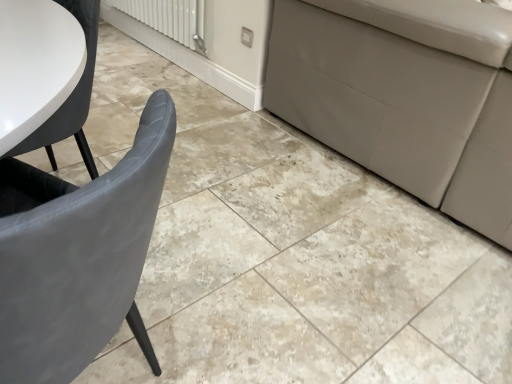
Question: From the image's perspective, is matte gray chair at left over white glossy radiator at upper center?

Choices:
 (A) no
 (B) yes

Answer: (A)

Question: Considering the relative sizes of matte gray chair at left and white glossy radiator at upper center in the image provided, is matte gray chair at left wider than white glossy radiator at upper center?

Choices:
 (A) no
 (B) yes

Answer: (B)

Question: From a real-world perspective, does matte gray chair at left sit lower than white glossy radiator at upper center?

Choices:
 (A) yes
 (B) no

Answer: (B)

Question: Does matte gray chair at left lie in front of white glossy radiator at upper center?

Choices:
 (A) yes
 (B) no

Answer: (A)

Question: Is the position of matte gray chair at left more distant than that of white glossy radiator at upper center?

Choices:
 (A) no
 (B) yes

Answer: (A)

Question: From a real-world perspective, is matte gray chair at left over white glossy radiator at upper center?

Choices:
 (A) no
 (B) yes

Answer: (B)

Question: Is white glossy radiator at upper center not near matte gray chair at left?

Choices:
 (A) yes
 (B) no

Answer: (A)

Question: Considering the relative positions of white glossy radiator at upper center and matte gray chair at left in the image provided, is white glossy radiator at upper center to the right of matte gray chair at left from the viewer's perspective?

Choices:
 (A) no
 (B) yes

Answer: (A)

Question: Does white glossy radiator at upper center turn towards matte gray chair at left?

Choices:
 (A) yes
 (B) no

Answer: (B)

Question: Is white glossy radiator at upper center at the left side of matte gray chair at left?

Choices:
 (A) no
 (B) yes

Answer: (B)

Question: Does white glossy radiator at upper center contain matte gray chair at left?

Choices:
 (A) yes
 (B) no

Answer: (B)

Question: Does white glossy radiator at upper center have a lesser width compared to matte gray chair at left?

Choices:
 (A) yes
 (B) no

Answer: (A)

Question: Is white glossy radiator at upper center wider or thinner than matte gray chair at left?

Choices:
 (A) thin
 (B) wide

Answer: (A)